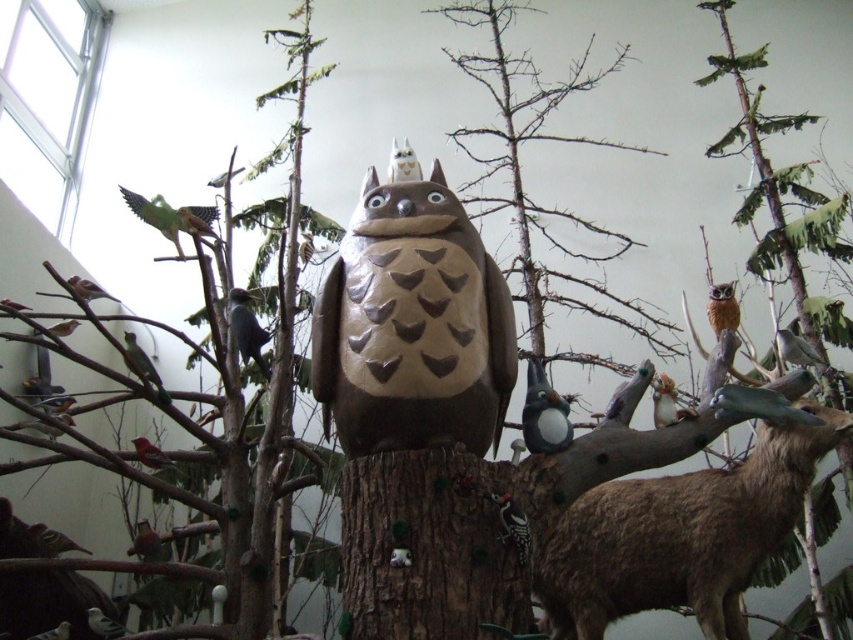
Does brown speckled bird at left appear on the right side of matte red bird at center?

Incorrect, brown speckled bird at left is not on the right side of matte red bird at center.

Can you confirm if brown speckled bird at left is positioned below matte red bird at center?

Incorrect, brown speckled bird at left is not positioned below matte red bird at center.

Is point (164, 396) farther from viewer compared to point (167, 458)?

No, it is not.

Find the location of a particular element. This screenshot has width=853, height=640. brown speckled bird at left is located at coordinates (143, 365).

Does point (767, 448) lie in front of point (254, 316)?

Yes.

Does brown matte deer at lower right lie in front of shiny black bird at center?

That is True.

I want to click on brown matte deer at lower right, so click(682, 534).

Find the location of a particular element. The image size is (853, 640). brown matte deer at lower right is located at coordinates (682, 534).

Between brown rough bark at center and brown speckled owl at upper right, which one is positioned higher?

brown speckled owl at upper right is higher up.

Can you confirm if brown rough bark at center is positioned to the left of brown speckled owl at upper right?

Indeed, brown rough bark at center is positioned on the left side of brown speckled owl at upper right.

Identify the location of brown rough bark at center. The image size is (853, 640). (432, 547).